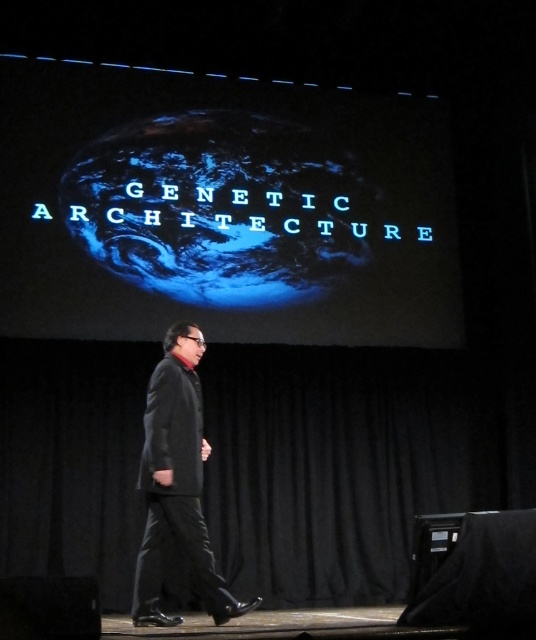
Question: Can you confirm if blue glossy planet at center is thinner than dark gray suit at center?

Choices:
 (A) no
 (B) yes

Answer: (A)

Question: Which point is farther from the camera taking this photo?

Choices:
 (A) (207, 573)
 (B) (332, 257)

Answer: (B)

Question: Does blue glossy planet at center appear on the left side of dark gray suit at center?

Choices:
 (A) yes
 (B) no

Answer: (B)

Question: Is blue glossy planet at center positioned in front of dark gray suit at center?

Choices:
 (A) no
 (B) yes

Answer: (A)

Question: Which point is farther to the camera?

Choices:
 (A) (174, 104)
 (B) (155, 592)

Answer: (A)